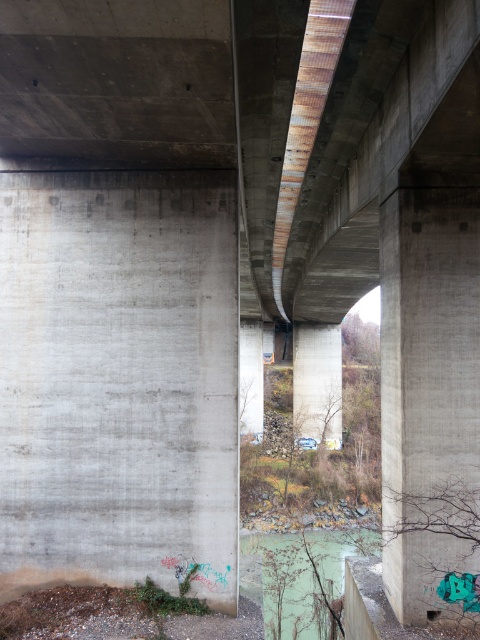
You are standing under the bridge and see the point at coordinates [119,378]. Based on the scene description, what object is located at that point?

The point at coordinates [119,378] indicates the gray concrete wall at left.

You are a construction worker inspecting the underside of a bridge. You notice two gray concrete structures in your view. One is the gray concrete wall at left and the other is the gray concrete pillar at center. Which of these two structures is taller?

The gray concrete pillar at center is taller than the gray concrete wall at left.